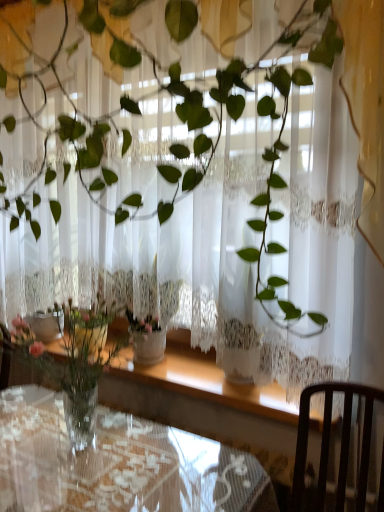
Where is `free point above clear glass table at center (from a real-world perspective)`? free point above clear glass table at center (from a real-world perspective) is located at coordinates (94, 443).